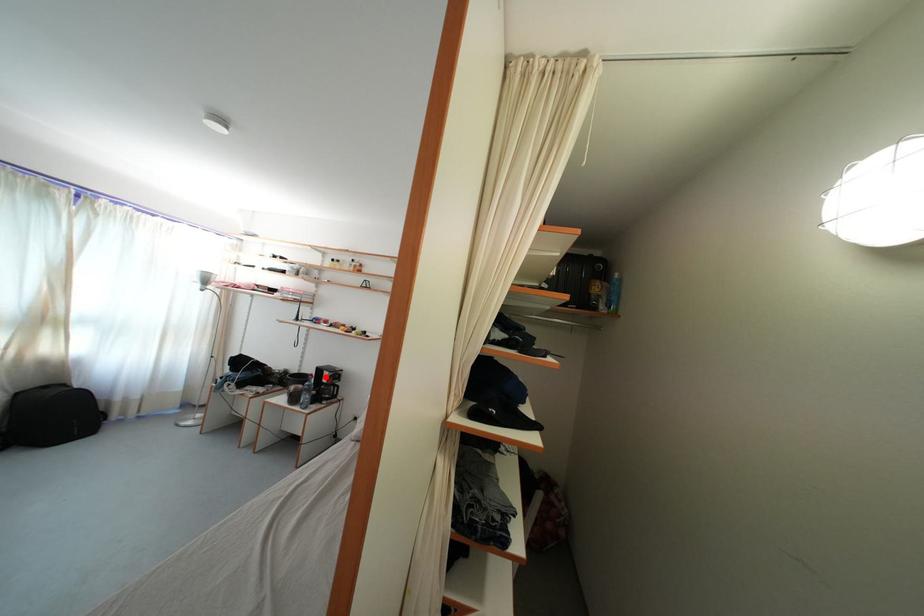
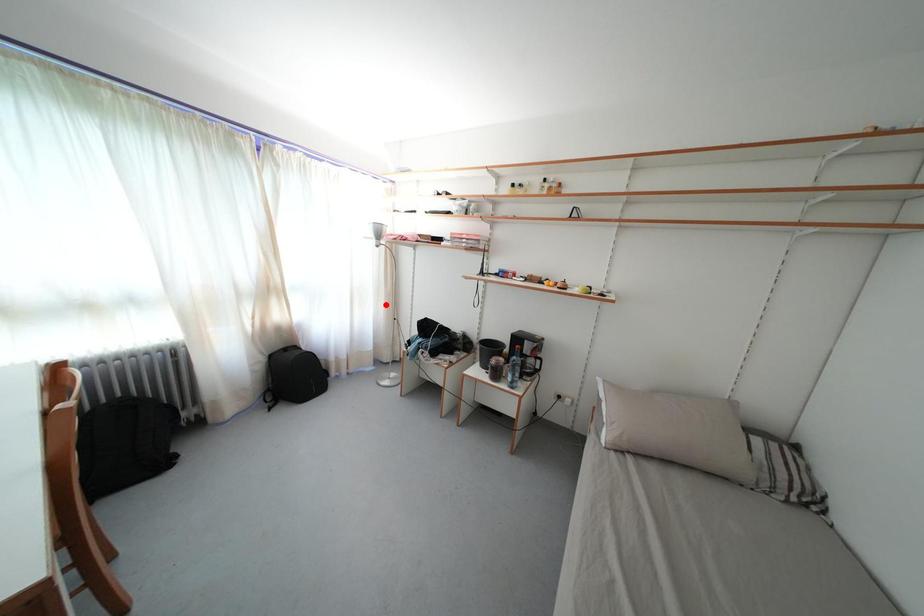
I am providing you with two images of the same scene from different viewpoints. A red point is marked on the first image and another point is marked on the second image. Is the marked point in image1 the same physical position as the marked point in image2?

No